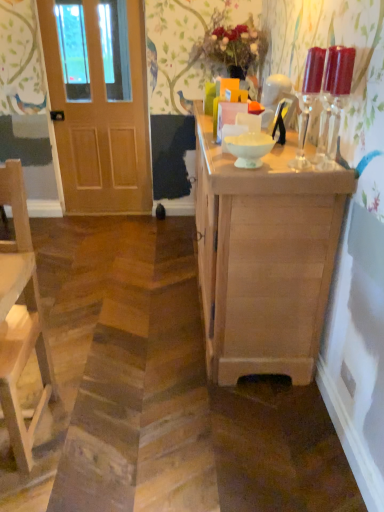
The height and width of the screenshot is (512, 384). What are the coordinates of `free spot behind clear glass candle holders at upper right, which ranks as the 1th candle holder in left-to-right order` in the screenshot? It's located at (293, 158).